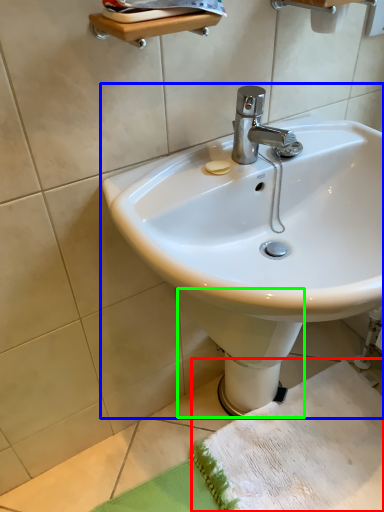
Question: Which object is the closest to the beach towel (highlighted by a red box)? Choose among these: sink (highlighted by a blue box) or bidet (highlighted by a green box).

Choices:
 (A) sink
 (B) bidet

Answer: (B)